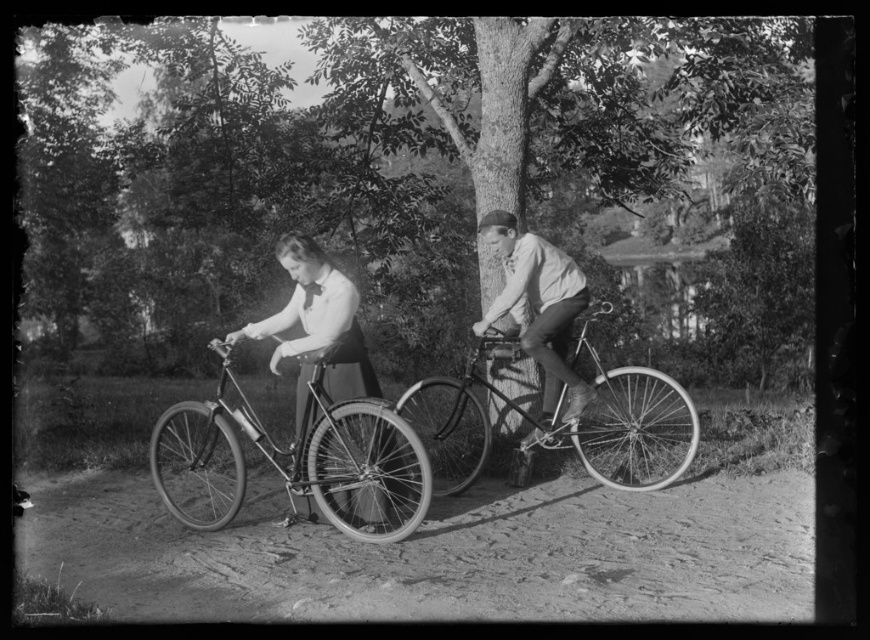
Question: Among these points, which one is farthest from the camera?

Choices:
 (A) (531, 292)
 (B) (393, 445)

Answer: (A)

Question: Which object is farther from the camera taking this photo?

Choices:
 (A) shiny metal bicycle at center
 (B) shiny metal bicycle at left

Answer: (A)

Question: Is dirt track at lower center wider than matte black bicycle at center?

Choices:
 (A) yes
 (B) no

Answer: (A)

Question: Does dirt track at lower center appear on the right side of smooth metal bicycle at center?

Choices:
 (A) yes
 (B) no

Answer: (B)

Question: Which point is farther to the camera?

Choices:
 (A) (571, 278)
 (B) (547, 422)
 (C) (342, 396)
 (D) (523, 556)

Answer: (B)

Question: Does shiny metal bicycle at left have a greater width compared to smooth metal bicycle at center?

Choices:
 (A) yes
 (B) no

Answer: (A)